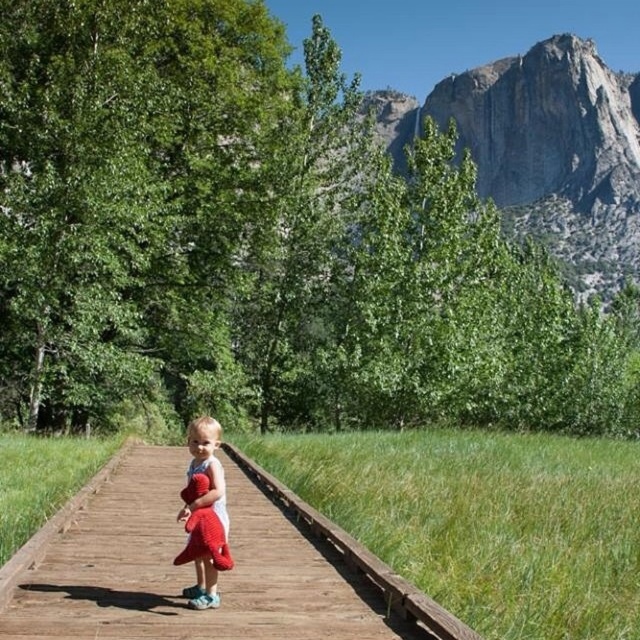
Question: Which object is farther from the camera taking this photo?

Choices:
 (A) wooden boardwalk at center
 (B) soft plush toy at center

Answer: (B)

Question: In this image, where is wooden boardwalk at center located relative to soft plush toy at center?

Choices:
 (A) left
 (B) right

Answer: (B)

Question: Does wooden boardwalk at center appear over soft plush toy at center?

Choices:
 (A) no
 (B) yes

Answer: (A)

Question: Is wooden boardwalk at center in front of soft plush toy at center?

Choices:
 (A) no
 (B) yes

Answer: (B)